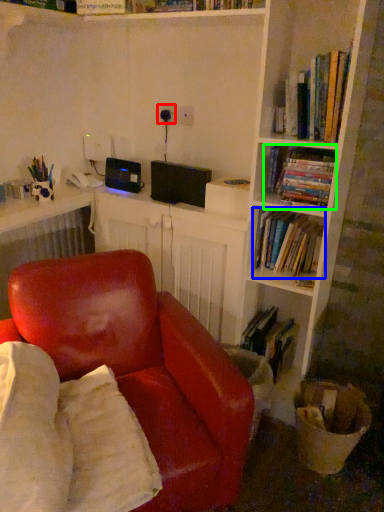
Question: Based on their relative distances, which object is nearer to electric outlet (highlighted by a red box)? Choose from book (highlighted by a blue box) and book (highlighted by a green box).

Choices:
 (A) book
 (B) book

Answer: (B)